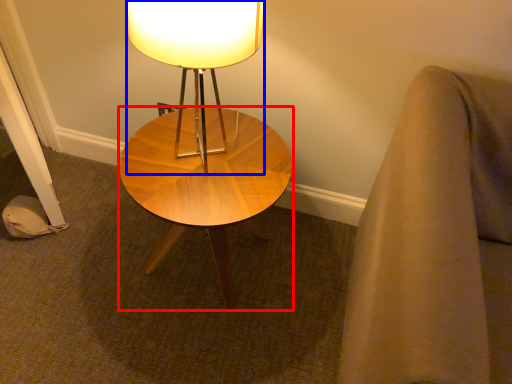
Question: Which object is further to the camera taking this photo, coffee table (highlighted by a red box) or lamp (highlighted by a blue box)?

Choices:
 (A) coffee table
 (B) lamp

Answer: (A)